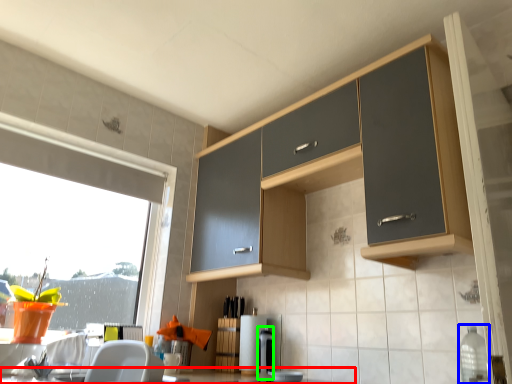
Question: Which object is positioned closest to countertop (highlighted by a red box)? Select from bottle (highlighted by a blue box) and appliance (highlighted by a green box).

Choices:
 (A) bottle
 (B) appliance

Answer: (B)